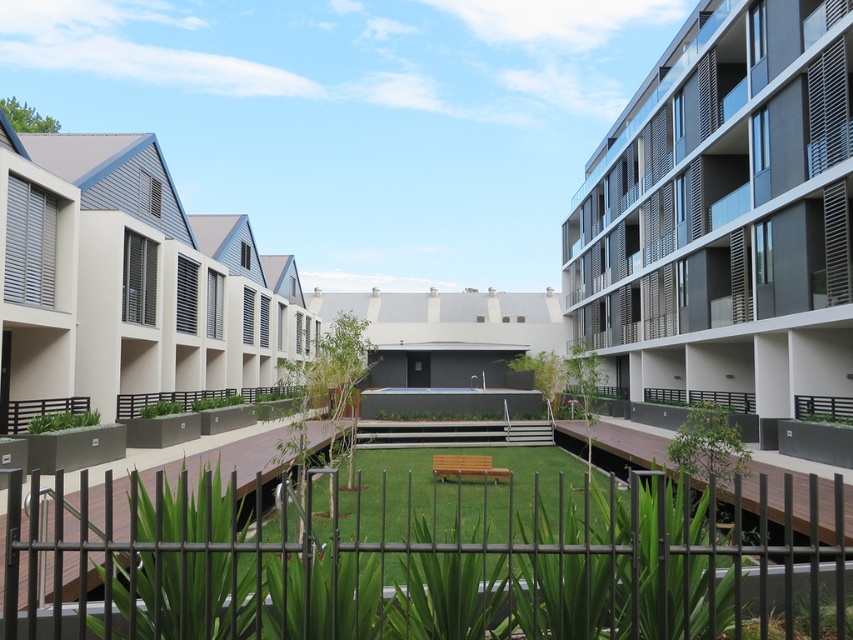
You are standing in the courtyard of the residential complex and want to walk from the wooden deck to the wooden bench. You notice two points marked on the ground at coordinates point (840, 193) and point (170, 316). Which point is closer to your current position if you are facing the buildings?

Answer: Point (840, 193) is closer to the viewer than point (170, 316). Since you are facing the buildings, the point closer to you would be point (840, 193).

You are a landscape architect designing a new garden in the courtyard. You need to place a new statue that requires a 3x3 meter space. Given the black metal fence at center and the beige textured building at left, which object can you place the statue next to without overlapping?

The beige textured building at left can accommodate the statue next to it because the beige textured building at left occupies more space than the black metal fence at center, allowing enough room for the 3x3 meter statue.

You are standing in the courtyard and want to take a photo of both the matte gray building at right and the beige textured building at left. Which building should you position closer to in order to capture both in the same frame?

To capture both the matte gray building at right and the beige textured building at left in the same frame, you should position yourself closer to the beige textured building at left since it is farther away from the viewer compared to the matte gray building at right.